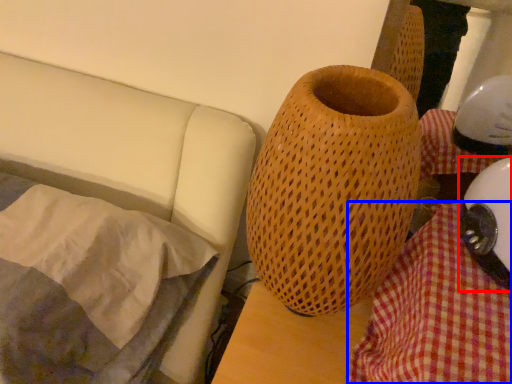
Question: Among these objects, which one is farthest to the camera, helmet (highlighted by a red box) or blanket (highlighted by a blue box)?

Choices:
 (A) helmet
 (B) blanket

Answer: (A)